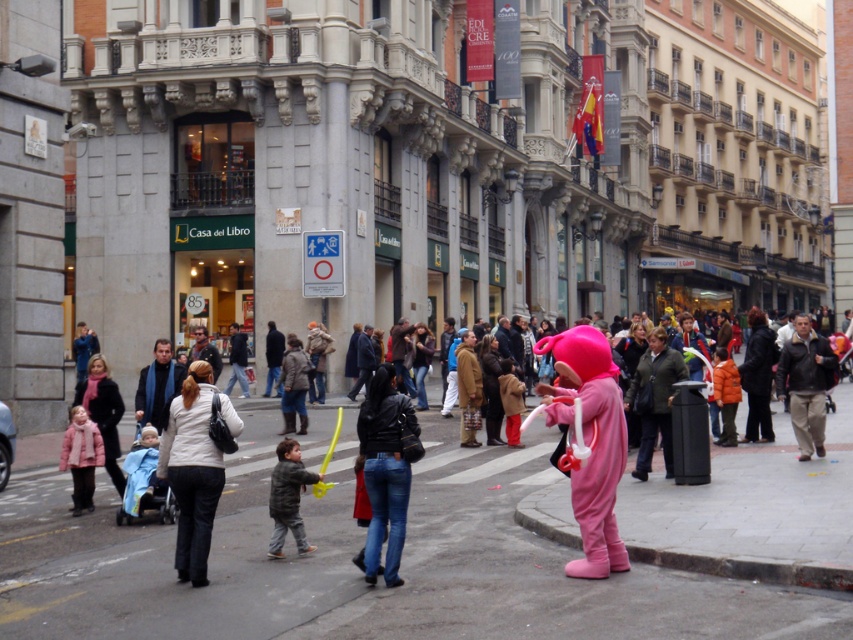
Consider the image. Between black leather jacket at center and dark gray jacket at center, which one is positioned lower?

dark gray jacket at center

Does black leather jacket at center have a greater width compared to dark gray jacket at center?

Incorrect, black leather jacket at center's width does not surpass dark gray jacket at center's.

The height and width of the screenshot is (640, 853). What do you see at coordinates (386, 470) in the screenshot?
I see `black leather jacket at center` at bounding box center [386, 470].

The image size is (853, 640). In order to click on black leather jacket at center in this screenshot , I will do `click(386, 470)`.

Is point (50, 582) closer to viewer compared to point (100, 436)?

Yes, it is.

Is pink fabric costume at center above matte pink coat at lower left?

Incorrect, pink fabric costume at center is not positioned above matte pink coat at lower left.

Is point (224, 516) in front of point (64, 465)?

Yes, it is.

You are a GUI agent. You are given a task and a screenshot of the screen. Output one action in this format:
    pyautogui.click(x=<x>, y=<y>)
    Task: Click on the pink fabric costume at center
    This screenshot has height=640, width=853.
    Given the screenshot: What is the action you would take?
    pyautogui.click(x=357, y=568)

Which is above, white matte jacket at center or dark gray jacket at center?

Positioned higher is white matte jacket at center.

Between white matte jacket at center and dark gray jacket at center, which one has less height?

dark gray jacket at center

Which is behind, point (198, 560) or point (273, 484)?

Positioned behind is point (273, 484).

Locate an element on the screen. Image resolution: width=853 pixels, height=640 pixels. white matte jacket at center is located at coordinates (192, 470).